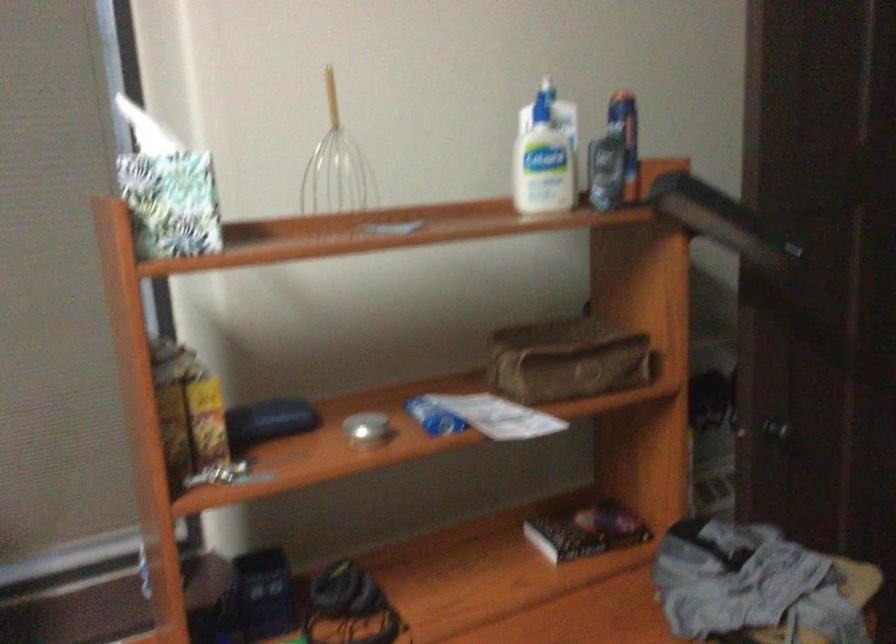
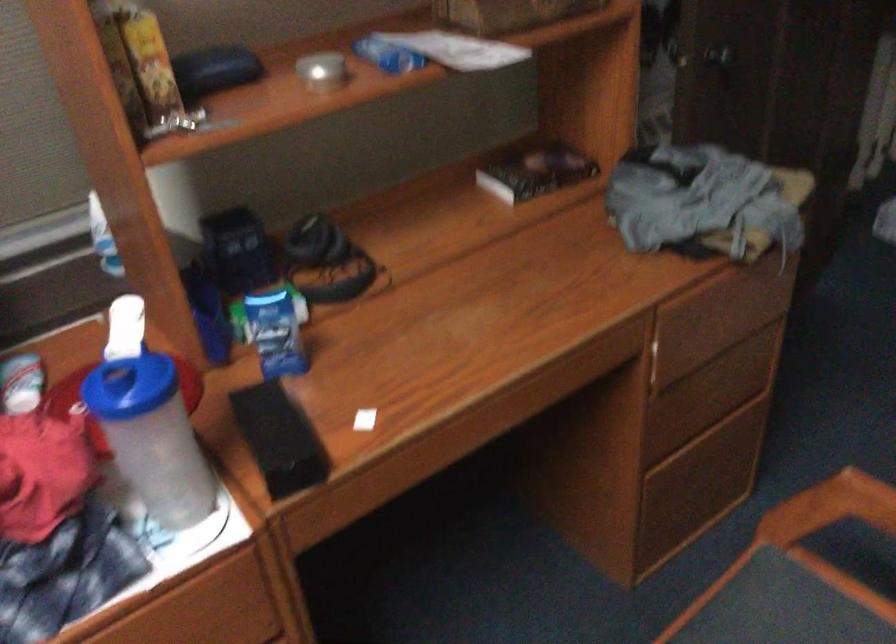
Locate, in the second image, the point that corresponds to pixel 363 430 in the first image.

(322, 71)